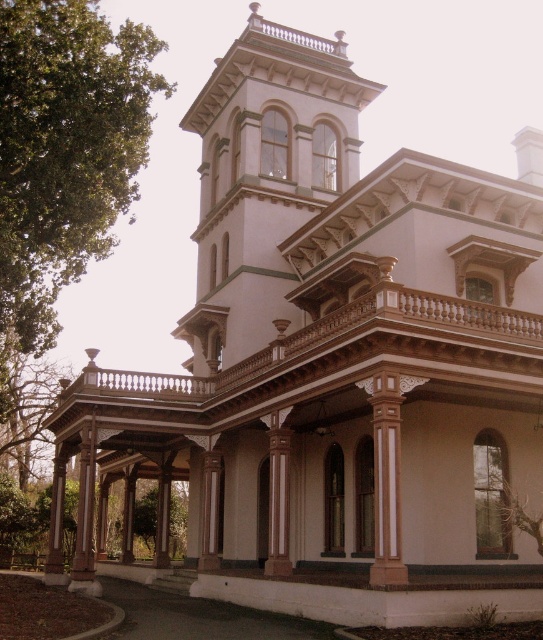
Which is more to the left, white painted wood bell tower at upper center or wooden carved balcony at center?

wooden carved balcony at center

Does white painted wood bell tower at upper center come behind wooden carved balcony at center?

Yes, it is behind wooden carved balcony at center.

Which is behind, point (249, 280) or point (318, 380)?

Point (249, 280)

Where is `white painted wood bell tower at upper center`? The width and height of the screenshot is (543, 640). white painted wood bell tower at upper center is located at coordinates (264, 179).